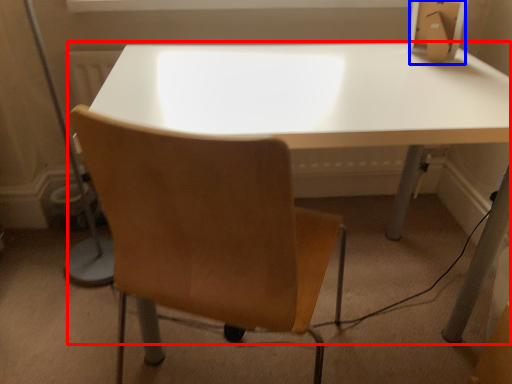
Question: Which point is closer to the camera, table (highlighted by a red box) or cardboard box (highlighted by a blue box)?

Choices:
 (A) table
 (B) cardboard box

Answer: (A)